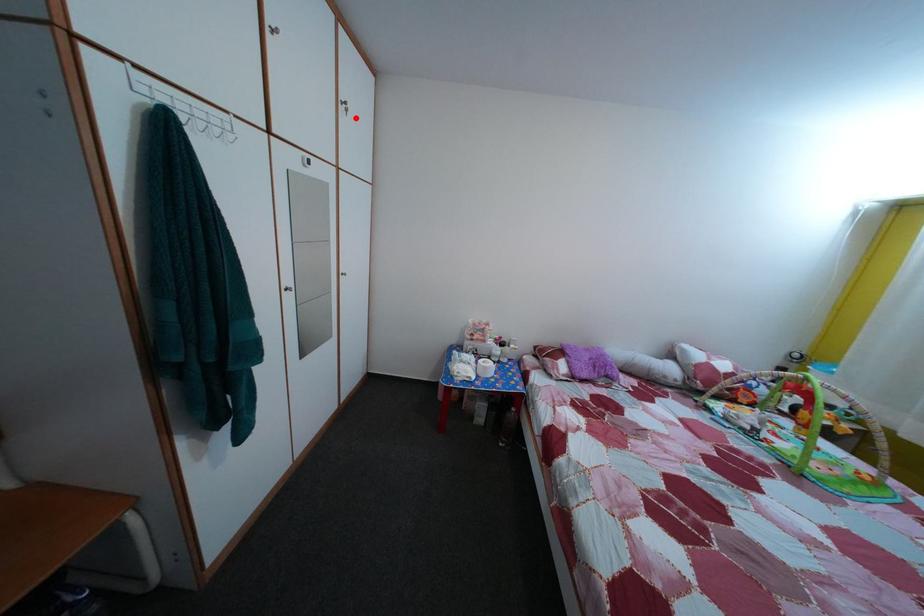
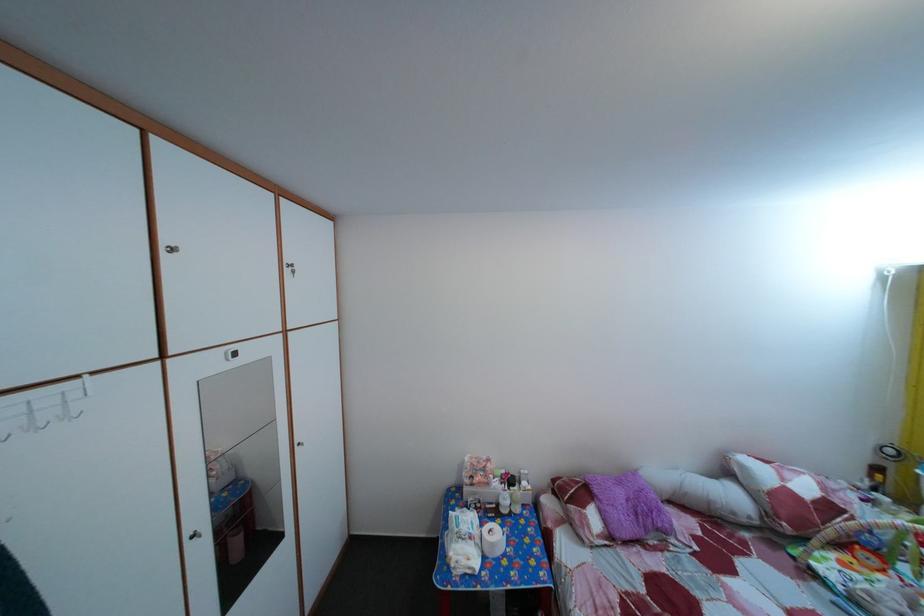
Where in the second image is the point corresponding to the highlighted location from the first image?

(304, 280)